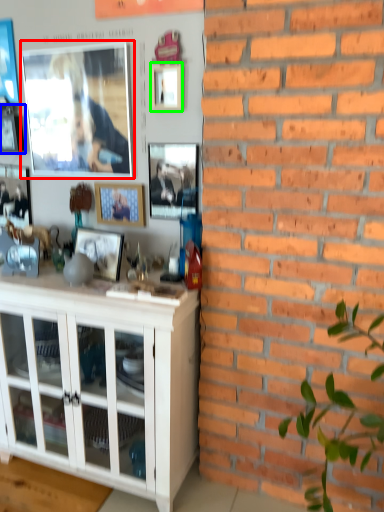
Question: Which object is the farthest from picture frame (highlighted by a red box)? Choose among these: picture frame (highlighted by a blue box) or picture frame (highlighted by a green box).

Choices:
 (A) picture frame
 (B) picture frame

Answer: (B)